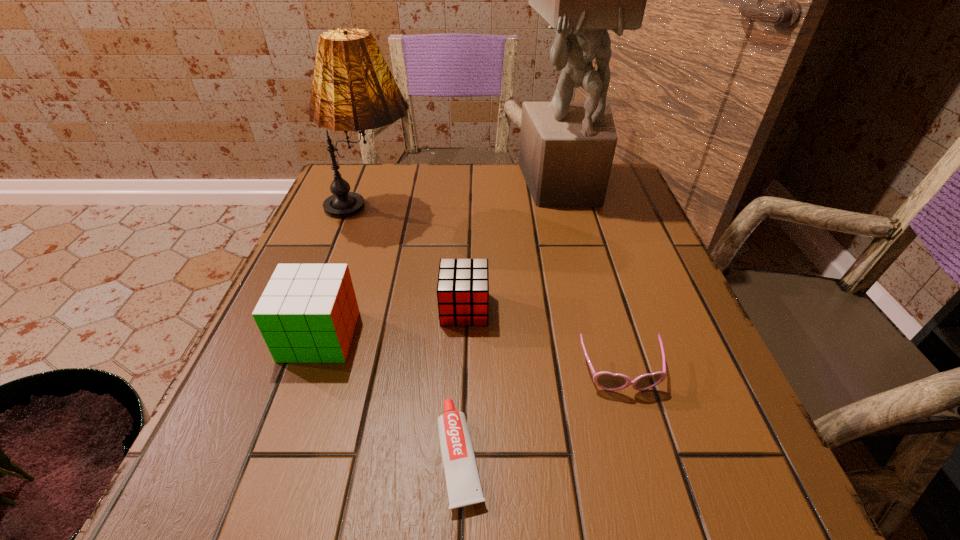
Locate an element on the screen. The height and width of the screenshot is (540, 960). sculpture at the right edge is located at coordinates (566, 152).

Locate an element on the screen. The width and height of the screenshot is (960, 540). sunglasses present at the right edge is located at coordinates (608, 381).

The height and width of the screenshot is (540, 960). I want to click on object present at the far left corner, so click(x=353, y=89).

In order to click on object at the far right corner in this screenshot , I will do `click(566, 152)`.

Image resolution: width=960 pixels, height=540 pixels. Find the location of `free space at the far edge`. free space at the far edge is located at coordinates (441, 179).

Locate an element on the screen. free location at the near edge of the desktop is located at coordinates (366, 463).

Identify the location of vacant space at the left edge. Image resolution: width=960 pixels, height=540 pixels. tap(350, 241).

The height and width of the screenshot is (540, 960). What are the coordinates of `vacant space at the right edge of the desktop` in the screenshot? It's located at (723, 408).

In the image, there is a desktop. Where is `vacant space at the far left corner`? This screenshot has height=540, width=960. vacant space at the far left corner is located at coordinates click(x=353, y=174).

In the image, there is a desktop. Identify the location of vacant space at the far right corner. (608, 190).